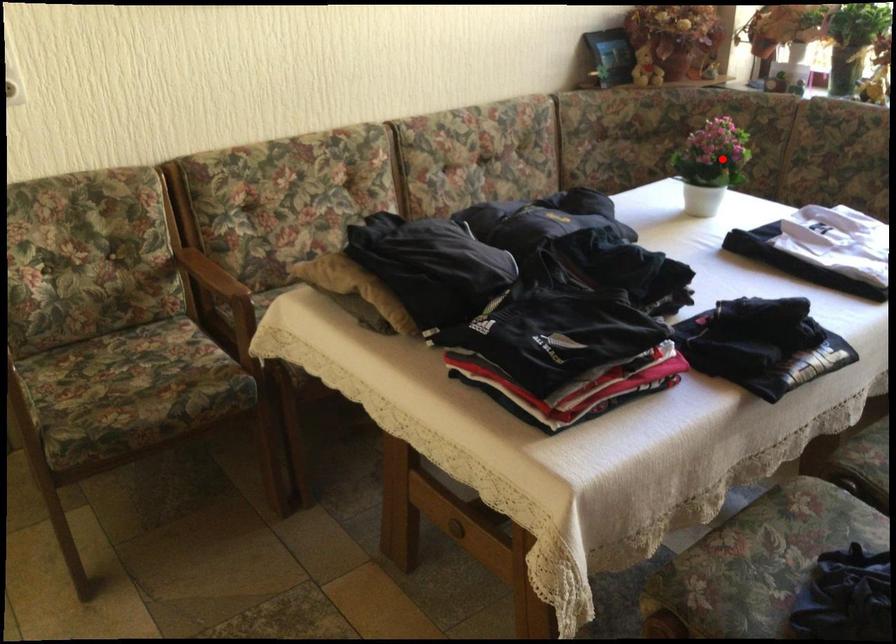
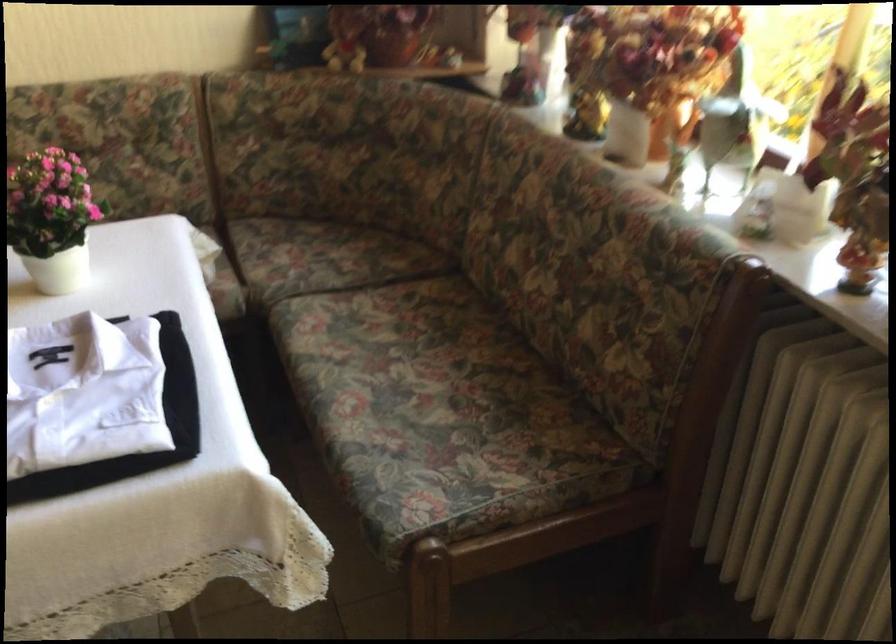
Question: I am providing you with two images of the same scene from different viewpoints. Given a red point in image1, look at the same physical point in image2. Is it:

Choices:
 (A) Closer to the viewpoint
 (B) Farther from the viewpoint

Answer: (A)